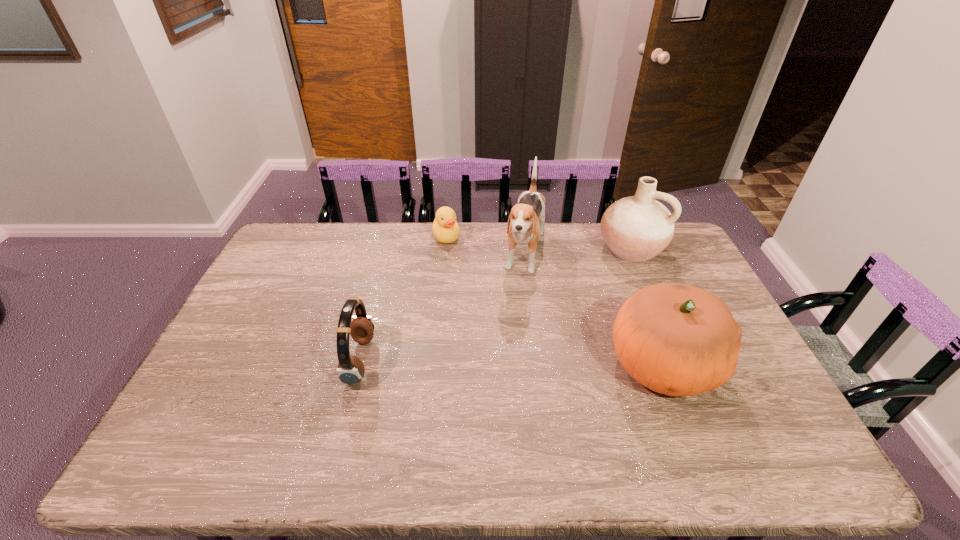
Where is `vacant spot on the desktop that is between the leftmost object and the pumpkin and is positioned at the beak of the shortest object`? The height and width of the screenshot is (540, 960). vacant spot on the desktop that is between the leftmost object and the pumpkin and is positioned at the beak of the shortest object is located at coordinates (475, 362).

Where is `free spot on the desktop that is between the headset and the pumpkin and is positioned to pour from the handle of the pottery`? free spot on the desktop that is between the headset and the pumpkin and is positioned to pour from the handle of the pottery is located at coordinates (532, 362).

Locate an element on the screen. The height and width of the screenshot is (540, 960). free space on the desktop that is between the fourth tallest object and the pumpkin and is positioned at the face of the third object from right to left is located at coordinates (497, 362).